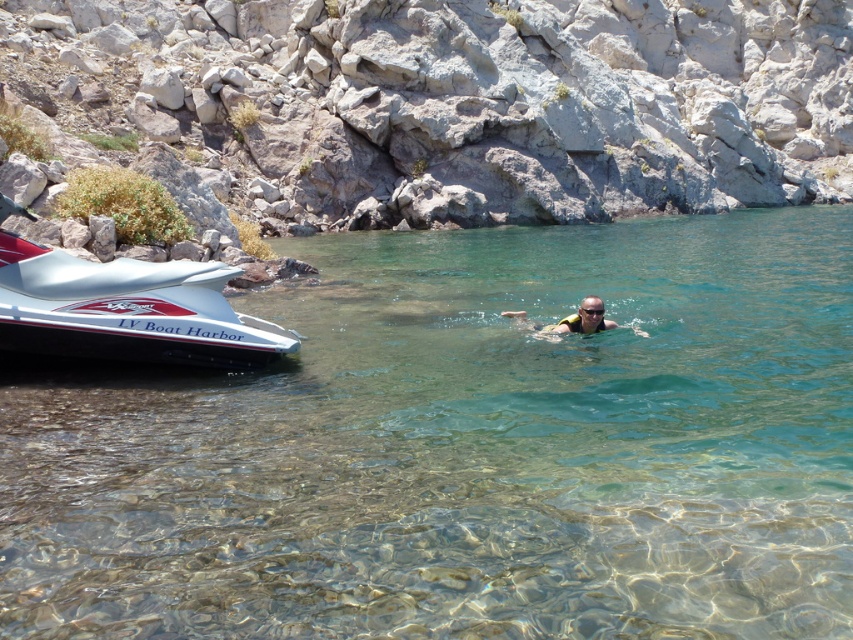
Which is behind, point (410, 492) or point (595, 308)?

The point (595, 308) is behind.

Which of these two, clear water at center or transparent plastic goggles at center, stands shorter?

Standing shorter between the two is transparent plastic goggles at center.

The height and width of the screenshot is (640, 853). Identify the location of clear water at center. (465, 449).

What do you see at coordinates (486, 99) in the screenshot?
I see `gray rock at upper center` at bounding box center [486, 99].

Who is taller, gray rock at upper center or tan skin swimmer at center?

With more height is gray rock at upper center.

Measure the distance between gray rock at upper center and camera.

They are 84.95 feet apart.

Identify the location of gray rock at upper center. The image size is (853, 640). (486, 99).

Which is more to the right, clear water at center or gray rock at upper center?

From the viewer's perspective, gray rock at upper center appears more on the right side.

Does clear water at center have a lesser width compared to gray rock at upper center?

Yes.

Is point (564, 436) in front of point (448, 77)?

Yes, point (564, 436) is in front of point (448, 77).

What are the coordinates of `clear water at center` in the screenshot? It's located at (465, 449).